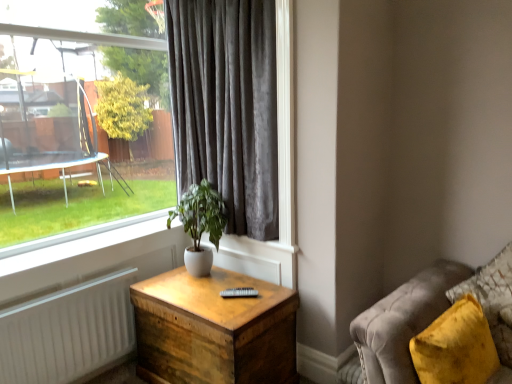
Question: Can you confirm if clear glass window at upper left is smaller than velvet yellow pillow at lower right?

Choices:
 (A) no
 (B) yes

Answer: (A)

Question: Can you confirm if clear glass window at upper left is bigger than velvet yellow pillow at lower right?

Choices:
 (A) yes
 (B) no

Answer: (A)

Question: Does clear glass window at upper left appear on the right side of velvet yellow pillow at lower right?

Choices:
 (A) yes
 (B) no

Answer: (B)

Question: Is velvet yellow pillow at lower right surrounded by clear glass window at upper left?

Choices:
 (A) no
 (B) yes

Answer: (A)

Question: From a real-world perspective, is clear glass window at upper left physically below velvet yellow pillow at lower right?

Choices:
 (A) no
 (B) yes

Answer: (A)

Question: Is clear glass window at upper left further to the viewer compared to velvet yellow pillow at lower right?

Choices:
 (A) no
 (B) yes

Answer: (B)

Question: Does velvet yellow pillow at lower right have a larger size compared to white ceramic plant at center?

Choices:
 (A) no
 (B) yes

Answer: (B)

Question: From a real-world perspective, is velvet yellow pillow at lower right beneath white ceramic plant at center?

Choices:
 (A) no
 (B) yes

Answer: (B)

Question: From the image's perspective, is velvet yellow pillow at lower right beneath white ceramic plant at center?

Choices:
 (A) yes
 (B) no

Answer: (A)

Question: Can you confirm if velvet yellow pillow at lower right is smaller than white ceramic plant at center?

Choices:
 (A) yes
 (B) no

Answer: (B)

Question: From a real-world perspective, does velvet yellow pillow at lower right stand above white ceramic plant at center?

Choices:
 (A) no
 (B) yes

Answer: (A)

Question: Is velvet yellow pillow at lower right facing towards white ceramic plant at center?

Choices:
 (A) yes
 (B) no

Answer: (B)

Question: Could you tell me if white ceramic plant at center is turned towards wooden nightstand at center?

Choices:
 (A) no
 (B) yes

Answer: (A)